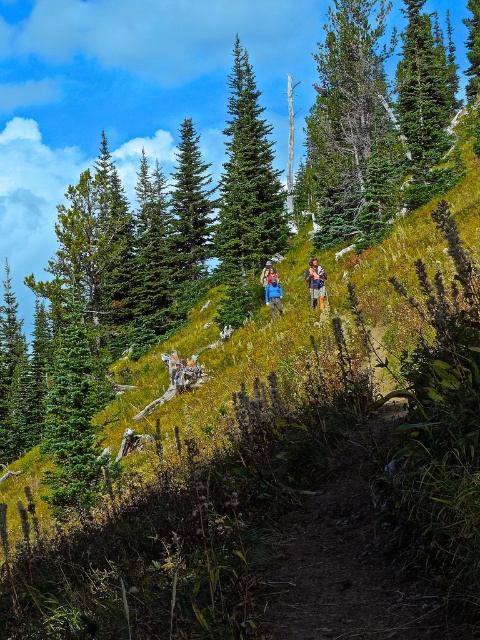
You are a hiker who wants to hang your blue fabric jacket at center on a branch of the green textured pine tree at center. Can you determine if the jacket will fit on a branch of the tree?

The green textured pine tree at center might be wider than blue fabric jacket at center, so it is possible that the branches can accommodate the jacket.